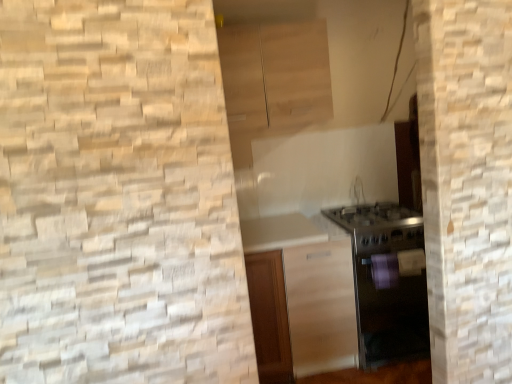
Question: Is satin wood cabinet at center, placed as the first cabinetry when sorted from bottom to top, not within light wood cabinet at upper center, which appears as the second cabinetry when ordered from the bottom?

Choices:
 (A) no
 (B) yes

Answer: (B)

Question: Considering the relative positions of satin wood cabinet at center, marked as the second cabinetry in a top-to-bottom arrangement, and light wood cabinet at upper center, acting as the first cabinetry starting from the top, in the image provided, is satin wood cabinet at center, marked as the second cabinetry in a top-to-bottom arrangement, to the left of light wood cabinet at upper center, acting as the first cabinetry starting from the top, from the viewer's perspective?

Choices:
 (A) no
 (B) yes

Answer: (A)

Question: From a real-world perspective, is satin wood cabinet at center, placed as the first cabinetry when sorted from bottom to top, physically above light wood cabinet at upper center, which appears as the second cabinetry when ordered from the bottom?

Choices:
 (A) yes
 (B) no

Answer: (B)

Question: Considering the relative sizes of satin wood cabinet at center, marked as the second cabinetry in a top-to-bottom arrangement, and light wood cabinet at upper center, which appears as the second cabinetry when ordered from the bottom, in the image provided, is satin wood cabinet at center, marked as the second cabinetry in a top-to-bottom arrangement, smaller than light wood cabinet at upper center, which appears as the second cabinetry when ordered from the bottom,?

Choices:
 (A) yes
 (B) no

Answer: (B)

Question: Can you confirm if satin wood cabinet at center, marked as the second cabinetry in a top-to-bottom arrangement, is taller than light wood cabinet at upper center, which appears as the second cabinetry when ordered from the bottom?

Choices:
 (A) yes
 (B) no

Answer: (A)

Question: Visually, is satin silver oven at lower right positioned to the left or to the right of satin wood cabinet at center, marked as the second cabinetry in a top-to-bottom arrangement?

Choices:
 (A) right
 (B) left

Answer: (A)

Question: Is point (420, 324) closer or farther from the camera than point (276, 349)?

Choices:
 (A) closer
 (B) farther

Answer: (B)

Question: Is satin silver oven at lower right in front of or behind satin wood cabinet at center, marked as the second cabinetry in a top-to-bottom arrangement, in the image?

Choices:
 (A) front
 (B) behind

Answer: (B)

Question: From a real-world perspective, is satin silver oven at lower right positioned above or below satin wood cabinet at center, marked as the second cabinetry in a top-to-bottom arrangement?

Choices:
 (A) above
 (B) below

Answer: (B)

Question: From a real-world perspective, is light wood cabinet at upper center, acting as the first cabinetry starting from the top, above or below satin wood cabinet at center, placed as the first cabinetry when sorted from bottom to top?

Choices:
 (A) above
 (B) below

Answer: (A)

Question: From their relative heights in the image, would you say light wood cabinet at upper center, acting as the first cabinetry starting from the top, is taller or shorter than satin wood cabinet at center, marked as the second cabinetry in a top-to-bottom arrangement?

Choices:
 (A) tall
 (B) short

Answer: (B)

Question: Which is correct: light wood cabinet at upper center, which appears as the second cabinetry when ordered from the bottom, is inside satin wood cabinet at center, marked as the second cabinetry in a top-to-bottom arrangement, or outside of it?

Choices:
 (A) inside
 (B) outside

Answer: (B)

Question: From the image's perspective, is light wood cabinet at upper center, acting as the first cabinetry starting from the top, located above or below satin wood cabinet at center, marked as the second cabinetry in a top-to-bottom arrangement?

Choices:
 (A) below
 (B) above

Answer: (B)

Question: Looking at the image, does light wood cabinet at upper center, which appears as the second cabinetry when ordered from the bottom, seem bigger or smaller compared to satin silver oven at lower right?

Choices:
 (A) small
 (B) big

Answer: (A)

Question: In the image, is light wood cabinet at upper center, which appears as the second cabinetry when ordered from the bottom, on the left side or the right side of satin silver oven at lower right?

Choices:
 (A) left
 (B) right

Answer: (A)